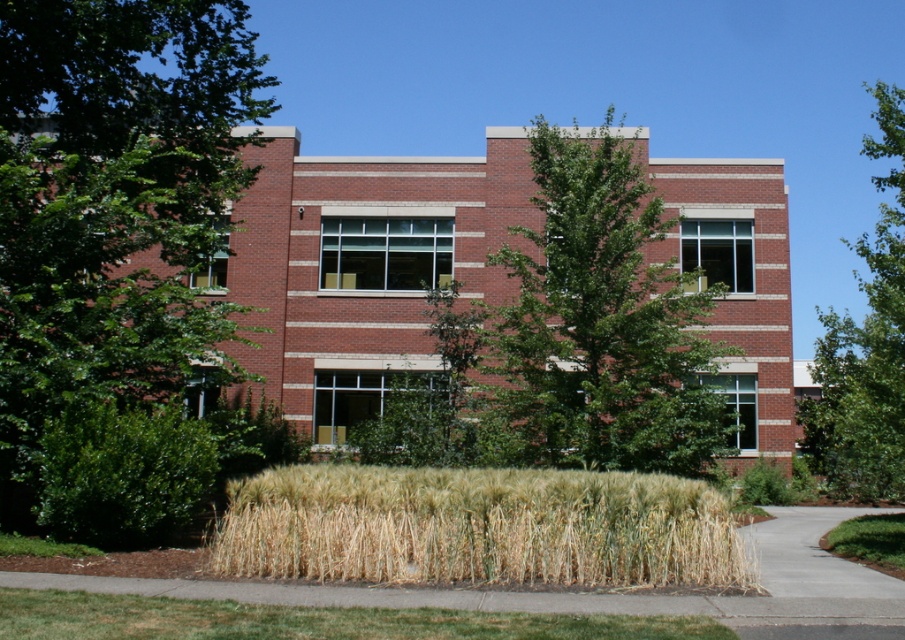
Which of these two, green leafy tree at left or green grass at lower center, stands taller?

green leafy tree at left

Which is more to the left, green leafy tree at left or green grass at lower center?

Positioned to the left is green leafy tree at left.

You are a GUI agent. You are given a task and a screenshot of the screen. Output one action in this format:
    pyautogui.click(x=<x>, y=<y>)
    Task: Click on the green leafy tree at left
    The width and height of the screenshot is (905, 640).
    Given the screenshot: What is the action you would take?
    pyautogui.click(x=110, y=204)

Can you confirm if green leafy tree at center is positioned to the left of green leafy grass at lower right?

Correct, you'll find green leafy tree at center to the left of green leafy grass at lower right.

Who is shorter, green leafy tree at center or green leafy grass at lower right?

Standing shorter between the two is green leafy grass at lower right.

Which is in front, point (545, 304) or point (887, 541)?

Point (887, 541) is more forward.

Identify the location of green leafy tree at center. (599, 324).

Can you confirm if dry straw at lower center is shorter than green leafy tree at upper right?

Indeed, dry straw at lower center has a lesser height compared to green leafy tree at upper right.

Does dry straw at lower center have a smaller size compared to green leafy tree at upper right?

Yes, dry straw at lower center is smaller than green leafy tree at upper right.

Which is in front, point (629, 474) or point (855, 419)?

Point (629, 474)

This screenshot has height=640, width=905. Identify the location of dry straw at lower center. (479, 528).